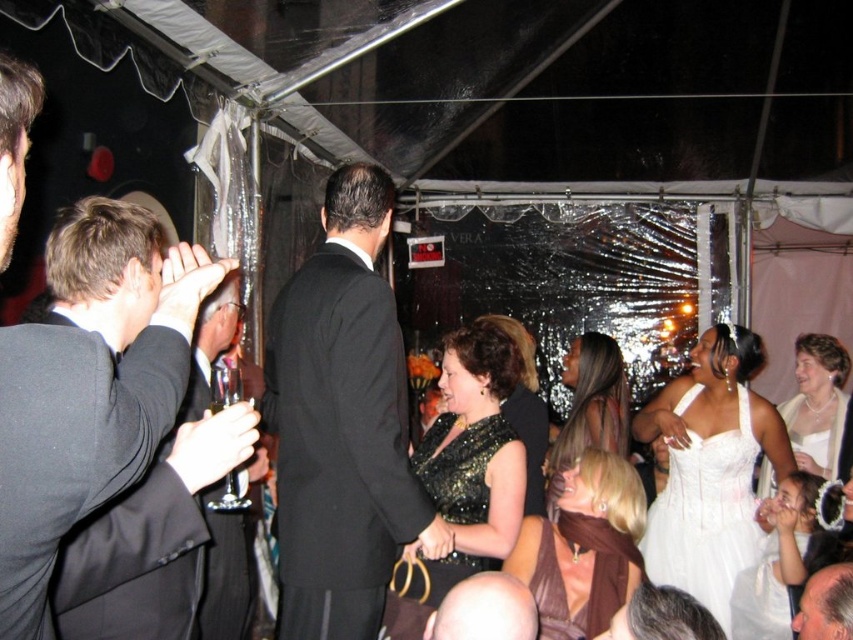
Question: Is black satin suit at center in front of brown satin dress at center?

Choices:
 (A) no
 (B) yes

Answer: (B)

Question: Which of these objects is positioned farthest from the white satin dress at center?

Choices:
 (A) shiny black dress at center
 (B) sequined black dress at center
 (C) bald head at center
 (D) brown satin dress at lower center

Answer: (C)

Question: Which object is the farthest from the brown satin dress at lower center?

Choices:
 (A) gray hair at center
 (B) bald head at center
 (C) sequined black dress at center
 (D) white satin dress at right

Answer: (D)

Question: Can you confirm if brown satin dress at lower center is positioned below shiny black dress at center?

Choices:
 (A) no
 (B) yes

Answer: (B)

Question: Which point is closer to the camera taking this photo?

Choices:
 (A) (91, 384)
 (B) (834, 576)
 (C) (590, 410)

Answer: (A)

Question: Can you confirm if dark gray suit at left is wider than white satin dress at right?

Choices:
 (A) no
 (B) yes

Answer: (A)